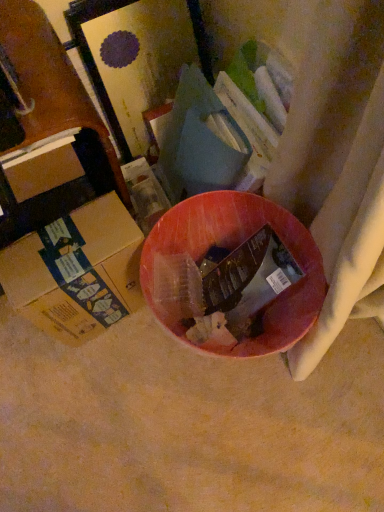
Question: In terms of height, does brown cardboard box at lower left, which is the first box from bottom to top, look taller or shorter compared to brown cardboard box at left, the 2th box ordered from the bottom?

Choices:
 (A) tall
 (B) short

Answer: (A)

Question: Is brown cardboard box at lower left, the second box positioned from the top, in front of or behind brown cardboard box at left, the 2th box ordered from the bottom, in the image?

Choices:
 (A) behind
 (B) front

Answer: (B)

Question: Do you think brown cardboard box at lower left, which is the first box from bottom to top, is within brown cardboard box at left, the 1th box positioned from the top, or outside of it?

Choices:
 (A) outside
 (B) inside

Answer: (A)

Question: Is brown cardboard box at left, the 1th box positioned from the top, situated inside brown cardboard box at lower left, which is the first box from bottom to top, or outside?

Choices:
 (A) outside
 (B) inside

Answer: (A)

Question: In terms of width, does brown cardboard box at left, the 1th box positioned from the top, look wider or thinner when compared to brown cardboard box at lower left, which is the first box from bottom to top?

Choices:
 (A) thin
 (B) wide

Answer: (A)

Question: From a real-world perspective, is brown cardboard box at left, the 1th box positioned from the top, above or below brown cardboard box at lower left, which is the first box from bottom to top?

Choices:
 (A) above
 (B) below

Answer: (A)

Question: Is brown cardboard box at left, the 1th box positioned from the top, taller or shorter than brown cardboard box at lower left, the second box positioned from the top?

Choices:
 (A) short
 (B) tall

Answer: (A)